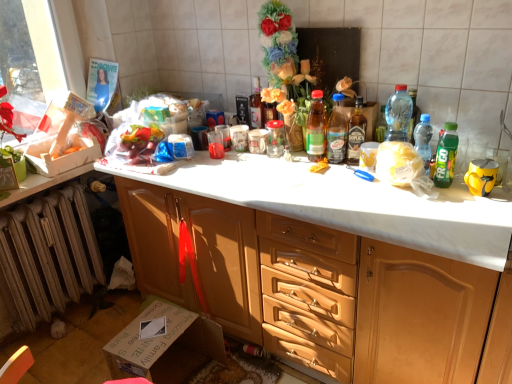
This screenshot has height=384, width=512. Find the location of `vacant area situated to the left side of translucent glass bottle at center, which is counted as the fourth bottle, starting from the right`. vacant area situated to the left side of translucent glass bottle at center, which is counted as the fourth bottle, starting from the right is located at coordinates (306, 163).